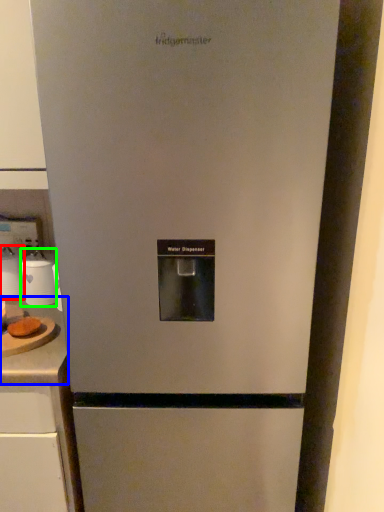
Question: Which is farther away from appliance (highlighted by a red box)? counter top (highlighted by a blue box) or appliance (highlighted by a green box)?

Choices:
 (A) counter top
 (B) appliance

Answer: (A)